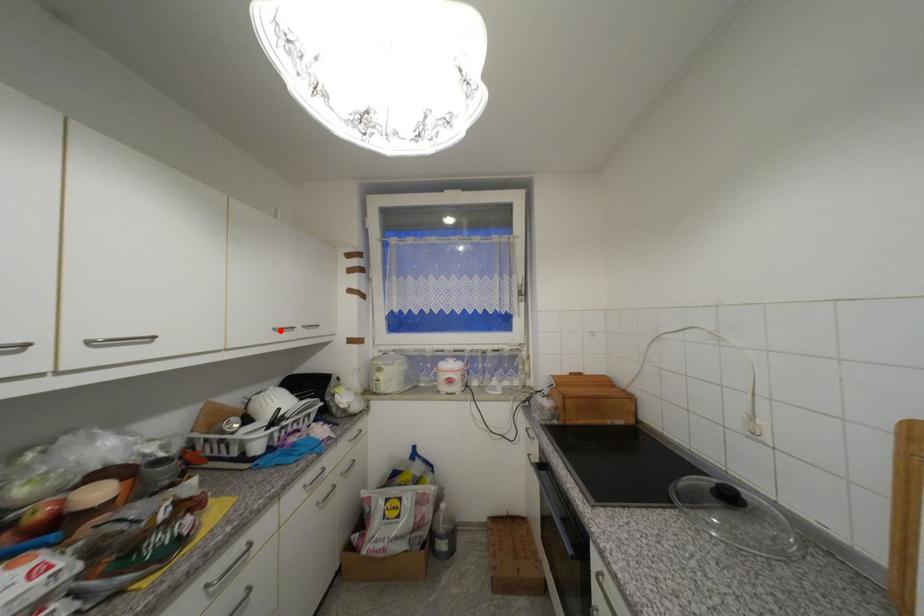
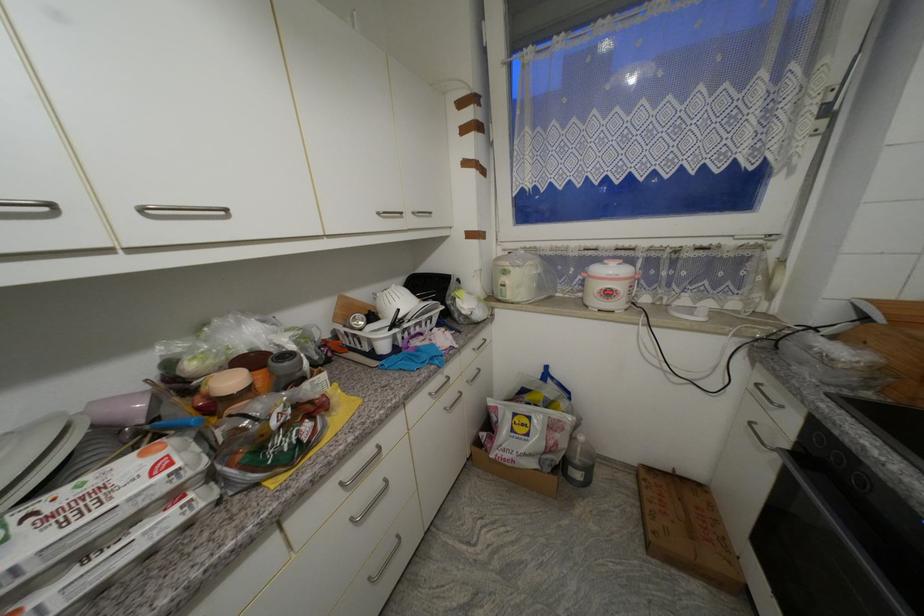
Locate, in the second image, the point that corresponds to the highlighted location in the first image.

(383, 215)